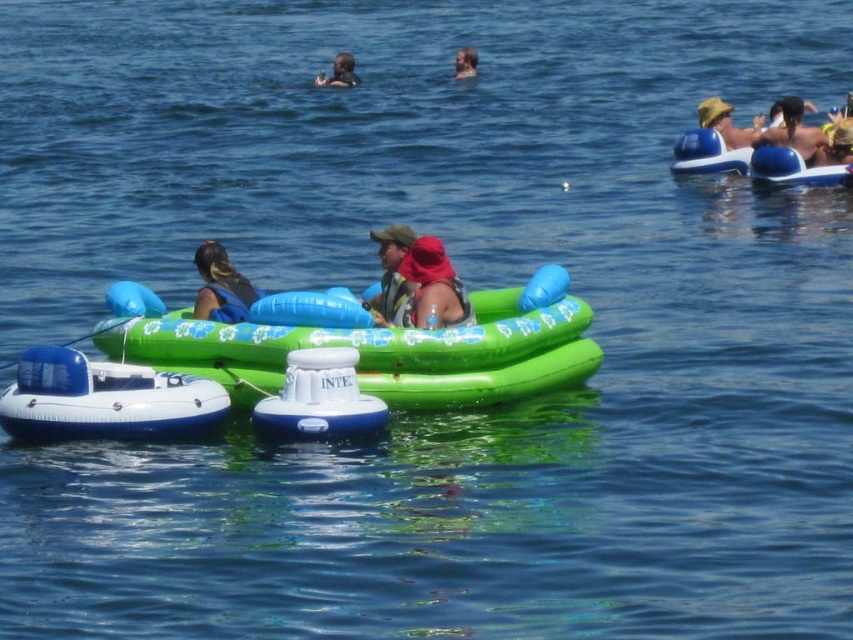
Is point (123, 435) positioned behind point (196, 268)?

No.

Who is taller, white glossy boat at lower left or blue fabric life vest at left?

Standing taller between the two is white glossy boat at lower left.

Who is more forward, (90, 403) or (216, 320)?

Positioned in front is point (90, 403).

Identify the location of white glossy boat at lower left. point(105,400).

Which is more to the left, smooth skin at upper center or smooth skin face at upper center?

smooth skin at upper center is more to the left.

Between smooth skin at upper center and smooth skin face at upper center, which one appears on the right side from the viewer's perspective?

smooth skin face at upper center is more to the right.

In order to click on smooth skin at upper center in this screenshot , I will do `click(339, 72)`.

Consider the image. Which is more to the left, blue rubber raft at upper right or matte green float at center?

matte green float at center is more to the left.

I want to click on blue rubber raft at upper right, so click(x=750, y=161).

Find the location of `blue rubber raft at upper right`. blue rubber raft at upper right is located at coordinates (750, 161).